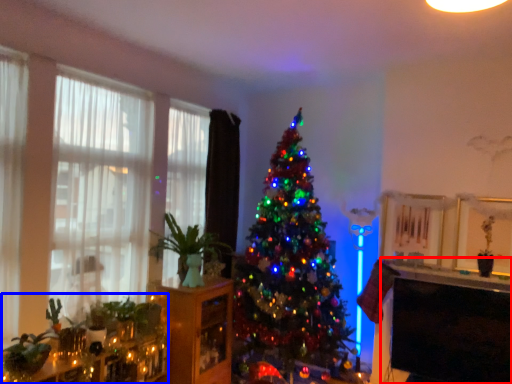
Question: Which point is further to the camera, table (highlighted by a red box) or christmas decoration (highlighted by a blue box)?

Choices:
 (A) table
 (B) christmas decoration

Answer: (A)